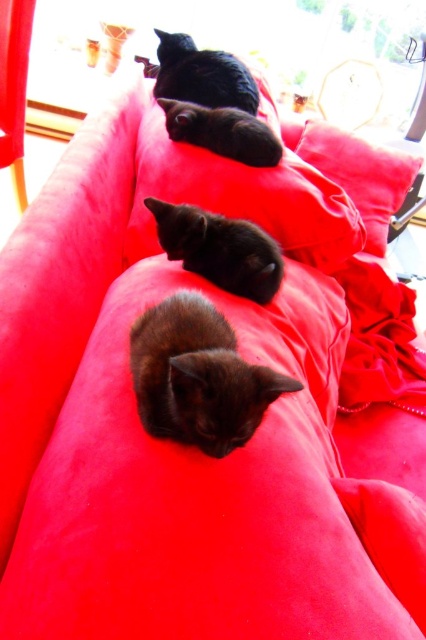
You are a photographer trying to capture the kittens on the couch. You need to place a small toy at the point labeled as point (362, 176) to attract their attention. Where exactly on the couch should you place the toy?

The point (362, 176) corresponds to the velvet cushion at center, so you should place the toy on the velvet cushion at center to attract the kittens.

You are a photographer setting up a shot of the three black kittens on the vibrant red couch. You want to place a small prop exactly where the velvet cushion at center is located. According to the coordinates provided, where should you position the prop relative to the couch?

The velvet cushion at center is located at point coordinates 0.275 on the x and 0.850 on the y axis. So you should place the prop at those coordinates relative to the couch.